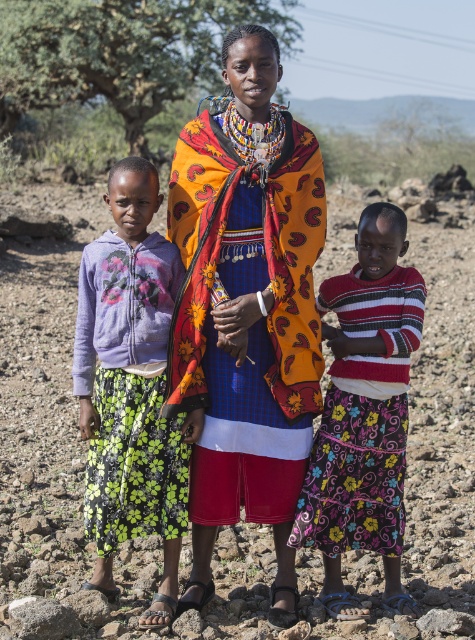
Question: Is vibrant woven fabric at center closer to camera compared to purple floral skirt at left?

Choices:
 (A) no
 (B) yes

Answer: (A)

Question: Does purple floral skirt at left have a lesser width compared to striped knit sweater at center?

Choices:
 (A) no
 (B) yes

Answer: (B)

Question: Does vibrant woven fabric at center have a smaller size compared to striped knit sweater at center?

Choices:
 (A) yes
 (B) no

Answer: (B)

Question: Which of the following is the farthest from the observer?

Choices:
 (A) (381, 244)
 (B) (210, 429)
 (C) (448, 518)
 (D) (114, 316)

Answer: (C)

Question: Which of the following is the closest to the observer?

Choices:
 (A) purple floral skirt at left
 (B) striped knit sweater at center
 (C) dull brown soil at center
 (D) vibrant woven fabric at center

Answer: (C)

Question: Which of the following is the farthest from the observer?

Choices:
 (A) (135, 522)
 (B) (44, 563)
 (C) (199, 481)
 (D) (353, 547)

Answer: (B)